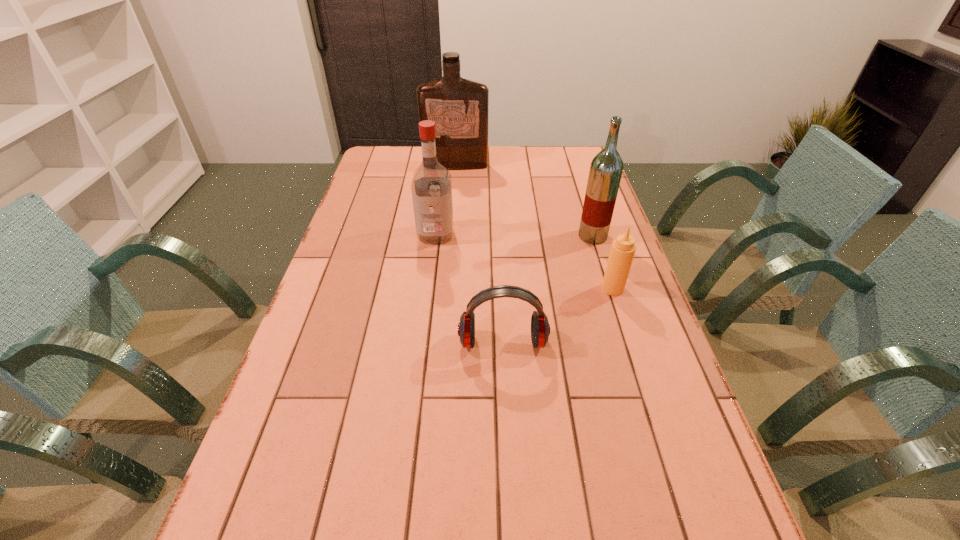
At what (x,y) coordinates should I click in order to perform the action: click on object situated at the far edge. Please return your answer as a coordinate pair (x, y). This screenshot has width=960, height=540. Looking at the image, I should click on (459, 107).

Identify the location of liquor at the right edge. The image size is (960, 540). (606, 168).

You are a GUI agent. You are given a task and a screenshot of the screen. Output one action in this format:
    pyautogui.click(x=<x>, y=<y>)
    Task: Click on the condiment that is at the right edge
    Image resolution: width=960 pixels, height=540 pixels.
    Given the screenshot: What is the action you would take?
    pyautogui.click(x=622, y=251)

What are the coordinates of `free point at the left edge` in the screenshot? It's located at (355, 291).

Locate an element on the screen. free region at the right edge is located at coordinates [716, 505].

Image resolution: width=960 pixels, height=540 pixels. What are the coordinates of `vacant space at the far left corner` in the screenshot? It's located at (399, 153).

Find the location of a particular element. free space between the rightmost liquor and the second shortest object is located at coordinates (603, 262).

This screenshot has width=960, height=540. I want to click on empty location between the fourth farthest object and the rightmost liquor, so click(603, 262).

Locate an element on the screen. This screenshot has height=540, width=960. object that is the second closest one to the shortest object is located at coordinates (431, 187).

Choose which object is the nearest neighbor to the earphone. Please provide its 2D coordinates. Your answer should be formatted as a tuple, i.e. [(x, y)], where the tuple contains the x and y coordinates of a point satisfying the conditions above.

[(622, 251)]